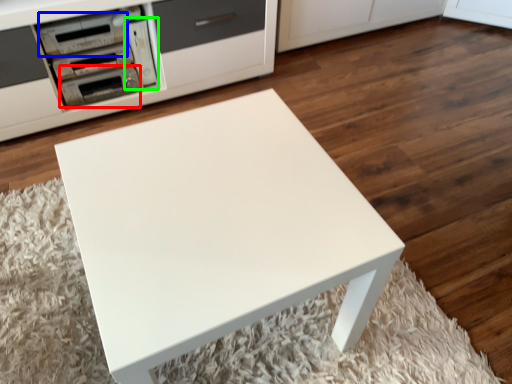
Question: Which object is positioned closest to appliance (highlighted by a red box)? Select from appliance (highlighted by a blue box) and appliance (highlighted by a green box).

Choices:
 (A) appliance
 (B) appliance

Answer: (B)